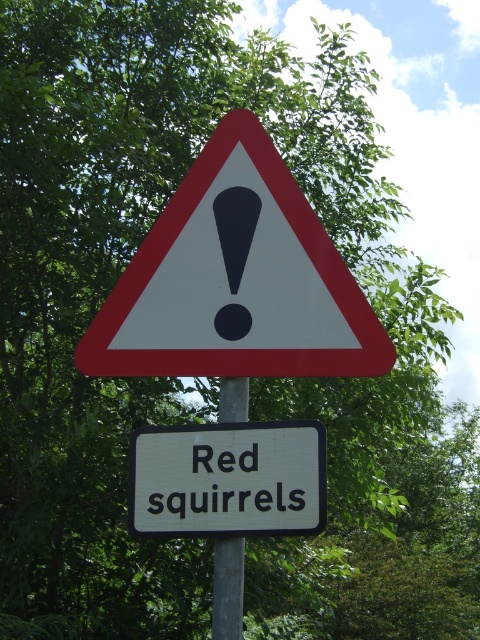
You are a hiker approaching the gray metallic pole at center with a white paper triangle at center. Which object will you see first as you get closer to the pole?

The white paper triangle at center will be seen first because it is positioned above the gray metallic pole at center, so it comes into view before the pole when approaching.

You are a hiker who wants to read the text on the white painted rectangular at center mounted on the gray metallic pole at center. Since you are standing at a distance, which object would appear larger to you?

The white painted rectangular at center is closer to the viewer than the gray metallic pole at center, so it would appear larger.

You are a delivery driver approaching a road sign pole. You need to know if you can pass your delivery truck between the white painted rectangular at center and the gray metallic pole at center. The truck is 8 inches wide. Can you safely pass through the space between them?

The white painted rectangular at center and gray metallic pole at center are 8.53 inches apart. Since the truck is 8 inches wide, it can safely pass through the space between them as there is enough clearance.